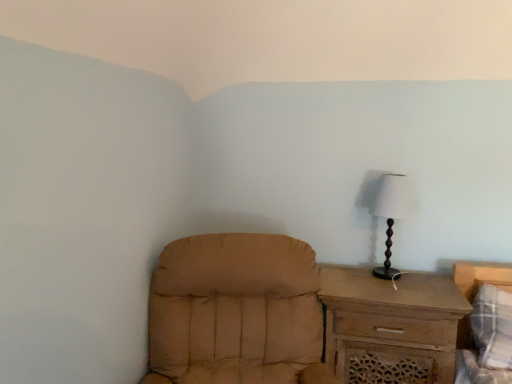
Find the location of `vacant location below white fabric lampshade at right (from a real-world perspective)`. vacant location below white fabric lampshade at right (from a real-world perspective) is located at coordinates (391, 281).